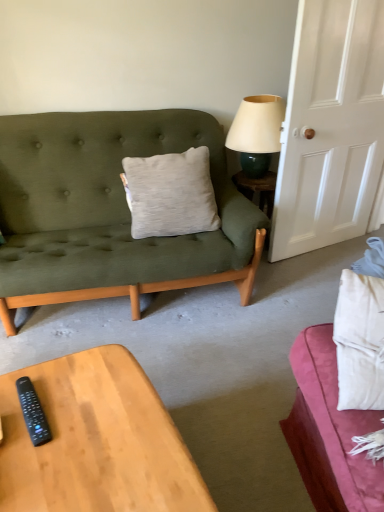
This screenshot has width=384, height=512. What are the coordinates of `empty space that is ontop of wooden coffee table at lower left (from a real-world perspective)` in the screenshot? It's located at (86, 430).